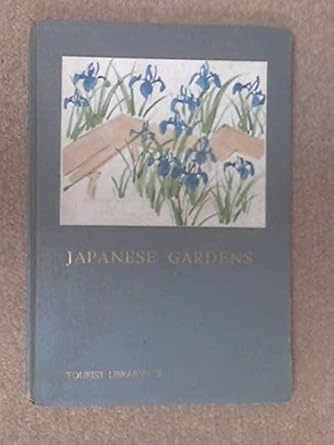
The height and width of the screenshot is (445, 334). Identify the location of book. (201, 313).